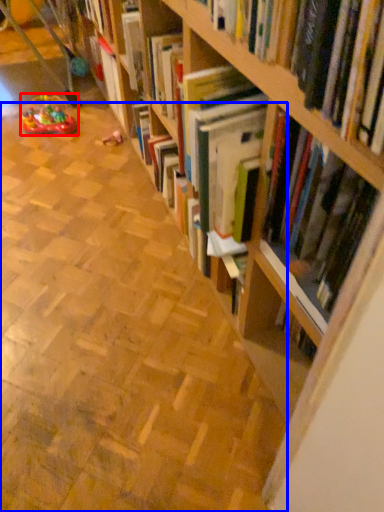
Question: Which of the following is the farthest to the observer, toy (highlighted by a red box) or aisle (highlighted by a blue box)?

Choices:
 (A) toy
 (B) aisle

Answer: (A)